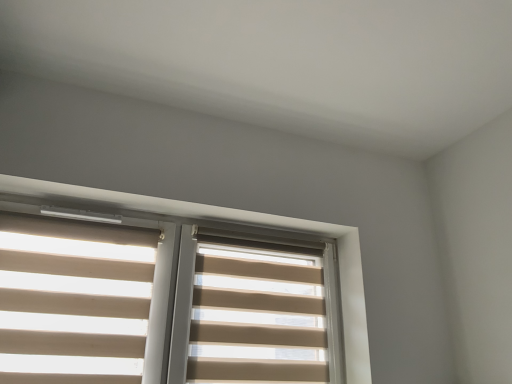
The image size is (512, 384). What do you see at coordinates (73, 300) in the screenshot?
I see `beige fabric blinds at left, which is the 1th blind from left to right` at bounding box center [73, 300].

I want to click on beige fabric blind at center, the 1th blind positioned from the right, so click(257, 316).

The image size is (512, 384). What do you see at coordinates (252, 222) in the screenshot? I see `beige fabric blinds at upper center` at bounding box center [252, 222].

This screenshot has width=512, height=384. I want to click on beige fabric blinds at left, which is the 1th blind from left to right, so click(73, 300).

Considering their positions, is beige fabric blinds at left, which is the 1th blind from left to right, located in front of or behind beige fabric blinds at upper center?

beige fabric blinds at left, which is the 1th blind from left to right, is positioned farther from the viewer than beige fabric blinds at upper center.

Considering the sizes of objects beige fabric blinds at left, which is the 1th blind from left to right, and beige fabric blinds at upper center in the image provided, who is taller, beige fabric blinds at left, which is the 1th blind from left to right, or beige fabric blinds at upper center?

With more height is beige fabric blinds at upper center.

Is beige fabric blinds at left, which is the 1th blind from left to right, wider or thinner than beige fabric blinds at upper center?

Considering their sizes, beige fabric blinds at left, which is the 1th blind from left to right, looks slimmer than beige fabric blinds at upper center.

From a real-world perspective, between beige fabric blinds at left, which is the 1th blind from left to right, and beige fabric blinds at upper center, who is vertically lower?

beige fabric blinds at left, which is the 1th blind from left to right, is physically lower.

How different are the orientations of beige fabric blinds at upper center and beige fabric blind at center, the 1th blind positioned from the right, in degrees?

1.68 degrees.

Relative to beige fabric blind at center, which is counted as the second blind, starting from the left, is beige fabric blinds at upper center in front or behind?

Clearly, beige fabric blinds at upper center is in front of beige fabric blind at center, which is counted as the second blind, starting from the left.

Considering the sizes of objects beige fabric blinds at upper center and beige fabric blind at center, the 1th blind positioned from the right, in the image provided, who is smaller, beige fabric blinds at upper center or beige fabric blind at center, the 1th blind positioned from the right,?

Smaller between the two is beige fabric blind at center, the 1th blind positioned from the right.

Is beige fabric blinds at upper center taller than beige fabric blind at center, which is counted as the second blind, starting from the left?

Correct, beige fabric blinds at upper center is much taller as beige fabric blind at center, which is counted as the second blind, starting from the left.

Which of these two, beige fabric blind at center, the 1th blind positioned from the right, or beige fabric blinds at left, acting as the second blind starting from the right, is bigger?

Bigger between the two is beige fabric blind at center, the 1th blind positioned from the right.

Is beige fabric blind at center, which is counted as the second blind, starting from the left, touching beige fabric blinds at left, acting as the second blind starting from the right?

There is a gap between beige fabric blind at center, which is counted as the second blind, starting from the left, and beige fabric blinds at left, acting as the second blind starting from the right.

What's the angular difference between beige fabric blind at center, which is counted as the second blind, starting from the left, and beige fabric blinds at left, acting as the second blind starting from the right,'s facing directions?

The facing directions of beige fabric blind at center, which is counted as the second blind, starting from the left, and beige fabric blinds at left, acting as the second blind starting from the right, are 0.00252 degrees apart.

Which object is wider, beige fabric blind at center, which is counted as the second blind, starting from the left, or beige fabric blinds at left, which is the 1th blind from left to right?

beige fabric blinds at left, which is the 1th blind from left to right, is wider.

From the image's perspective, is beige fabric blinds at left, which is the 1th blind from left to right, above or below beige fabric blind at center, the 1th blind positioned from the right?

Clearly, from the image's perspective, beige fabric blinds at left, which is the 1th blind from left to right, is above beige fabric blind at center, the 1th blind positioned from the right.

From a real-world perspective, relative to beige fabric blind at center, which is counted as the second blind, starting from the left, is beige fabric blinds at left, acting as the second blind starting from the right, vertically above or below?

Clearly, from a real-world perspective, beige fabric blinds at left, acting as the second blind starting from the right, is below beige fabric blind at center, which is counted as the second blind, starting from the left.

Between beige fabric blinds at left, which is the 1th blind from left to right, and beige fabric blind at center, the 1th blind positioned from the right, which one has more height?

beige fabric blinds at left, which is the 1th blind from left to right, is taller.

From a real-world perspective, is beige fabric blind at center, which is counted as the second blind, starting from the left, located higher than beige fabric blinds at upper center?

Incorrect, from a real-world perspective, beige fabric blind at center, which is counted as the second blind, starting from the left, is lower than beige fabric blinds at upper center.

Who is more distant, beige fabric blind at center, which is counted as the second blind, starting from the left, or beige fabric blinds at upper center?

beige fabric blind at center, which is counted as the second blind, starting from the left, is further away from the camera.

Looking at their sizes, would you say beige fabric blind at center, which is counted as the second blind, starting from the left, is wider or thinner than beige fabric blinds at upper center?

Clearly, beige fabric blind at center, which is counted as the second blind, starting from the left, has less width compared to beige fabric blinds at upper center.

Could you measure the distance between beige fabric blind at center, which is counted as the second blind, starting from the left, and beige fabric blinds at upper center?

A distance of 27.73 centimeters exists between beige fabric blind at center, which is counted as the second blind, starting from the left, and beige fabric blinds at upper center.

Relative to beige fabric blinds at left, acting as the second blind starting from the right, is beige fabric blinds at upper center in front or behind?

beige fabric blinds at upper center is positioned closer to the viewer than beige fabric blinds at left, acting as the second blind starting from the right.

Considering the sizes of objects beige fabric blinds at upper center and beige fabric blinds at left, which is the 1th blind from left to right, in the image provided, who is taller, beige fabric blinds at upper center or beige fabric blinds at left, which is the 1th blind from left to right,?

With more height is beige fabric blinds at upper center.

Is beige fabric blinds at left, acting as the second blind starting from the right, surrounded by beige fabric blinds at upper center?

Yes, beige fabric blinds at left, acting as the second blind starting from the right, is inside beige fabric blinds at upper center.

From the image's perspective, is beige fabric blinds at upper center on beige fabric blinds at left, acting as the second blind starting from the right?

No, from the image's perspective, beige fabric blinds at upper center is not over beige fabric blinds at left, acting as the second blind starting from the right.

You are a GUI agent. You are given a task and a screenshot of the screen. Output one action in this format:
    pyautogui.click(x=<x>, y=<y>)
    Task: Click on the window that appears below the beige fabric blinds at left, acting as the second blind starting from the right (from the image's perspective)
    
    Given the screenshot: What is the action you would take?
    pyautogui.click(x=252, y=222)

Locate an element on the screen. This screenshot has height=384, width=512. window that appears above the beige fabric blind at center, which is counted as the second blind, starting from the left (from a real-world perspective) is located at coordinates (252, 222).

Based on the photo, looking at the image, which one is located closer to beige fabric blinds at left, which is the 1th blind from left to right, beige fabric blinds at upper center or beige fabric blind at center, the 1th blind positioned from the right?

The object closer to beige fabric blinds at left, which is the 1th blind from left to right, is beige fabric blinds at upper center.

Consider the image. Which object lies nearer to the anchor point beige fabric blinds at left, which is the 1th blind from left to right, beige fabric blind at center, which is counted as the second blind, starting from the left, or beige fabric blinds at upper center?

Based on the image, beige fabric blinds at upper center appears to be nearer to beige fabric blinds at left, which is the 1th blind from left to right.

When comparing their distances from beige fabric blinds at upper center, does beige fabric blind at center, the 1th blind positioned from the right, or beige fabric blinds at left, which is the 1th blind from left to right, seem closer?

beige fabric blind at center, the 1th blind positioned from the right, is positioned closer to the anchor beige fabric blinds at upper center.

Considering their positions, is beige fabric blinds at upper center positioned closer to beige fabric blind at center, the 1th blind positioned from the right, than beige fabric blinds at left, acting as the second blind starting from the right?

The object closer to beige fabric blind at center, the 1th blind positioned from the right, is beige fabric blinds at upper center.

Which object lies nearer to the anchor point beige fabric blinds at upper center, beige fabric blinds at left, which is the 1th blind from left to right, or beige fabric blind at center, which is counted as the second blind, starting from the left?

beige fabric blind at center, which is counted as the second blind, starting from the left, lies closer to beige fabric blinds at upper center than the other object.

Considering their positions, is beige fabric blinds at left, acting as the second blind starting from the right, positioned further to beige fabric blind at center, which is counted as the second blind, starting from the left, than beige fabric blinds at upper center?

Based on the image, beige fabric blinds at left, acting as the second blind starting from the right, appears to be further to beige fabric blind at center, which is counted as the second blind, starting from the left.

Identify the location of window between beige fabric blinds at left, which is the 1th blind from left to right, and beige fabric blind at center, which is counted as the second blind, starting from the left, from left to right. The height and width of the screenshot is (384, 512). (252, 222).